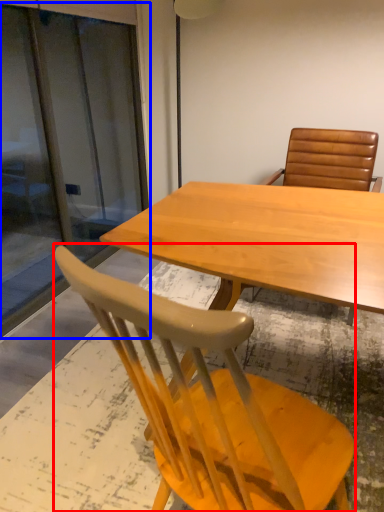
Question: Which object appears closest to the camera in this image, chair (highlighted by a red box) or screen door (highlighted by a blue box)?

Choices:
 (A) chair
 (B) screen door

Answer: (A)